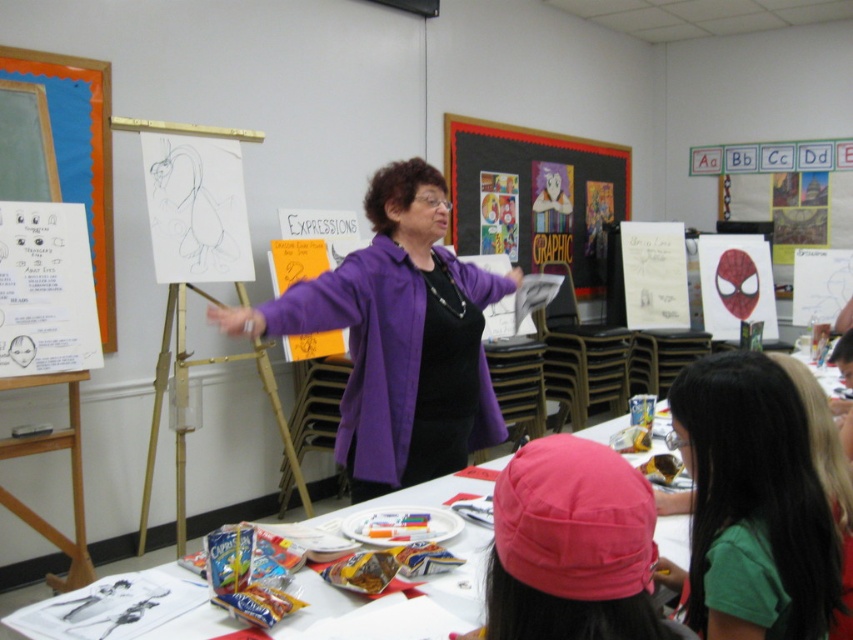
Question: From the image, what is the correct spatial relationship of purple matte jacket at center in relation to pink fabric cap at center?

Choices:
 (A) right
 (B) left

Answer: (B)

Question: Does purple matte jacket at center have a lesser width compared to green matte hair at lower right?

Choices:
 (A) no
 (B) yes

Answer: (A)

Question: Which object is farther from the camera taking this photo?

Choices:
 (A) pink fabric cap at center
 (B) green matte hair at lower right
 (C) matte black bulletin board at center

Answer: (C)

Question: Is white paper at center smaller than pink fabric cap at center?

Choices:
 (A) yes
 (B) no

Answer: (B)

Question: Which point appears farthest from the camera in this image?

Choices:
 (A) (177, 525)
 (B) (646, 518)
 (C) (709, 481)

Answer: (A)

Question: Which point is closer to the camera?

Choices:
 (A) (587, 440)
 (B) (698, 541)
 (C) (27, 93)

Answer: (A)